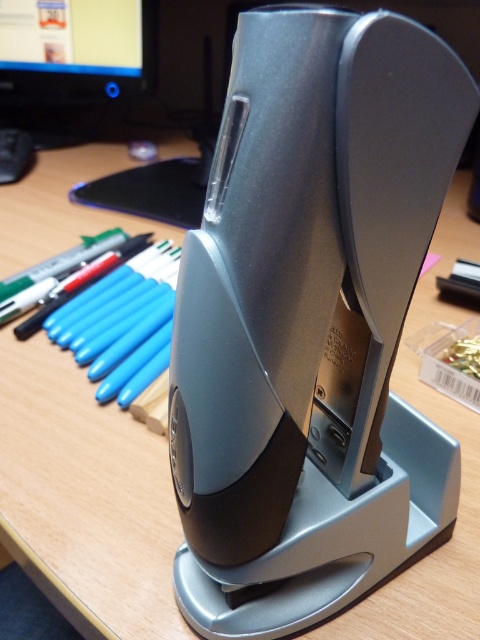
You are standing in front of the desk and want to reach the matte black monitor at upper left. Given that your outstretched arm can reach up to 2.3 feet, can you comfortably reach it without moving your feet?

The matte black monitor at upper left is 4.61 feet away from you, which is beyond the 2.3 feet reach of your outstretched arm. Therefore, you cannot comfortably reach it without moving your feet.

You are standing at a distance of 5 feet from the wooden desk where the sleek, modern office device is placed. Can you reach the point at coordinates (104, 40) on the desk without moving closer?

The distance of point (104, 40) from the viewer is 4.78 feet, which is less than 5 feet. Therefore, you can reach the point at coordinates (104, 40) on the desk without moving closer.